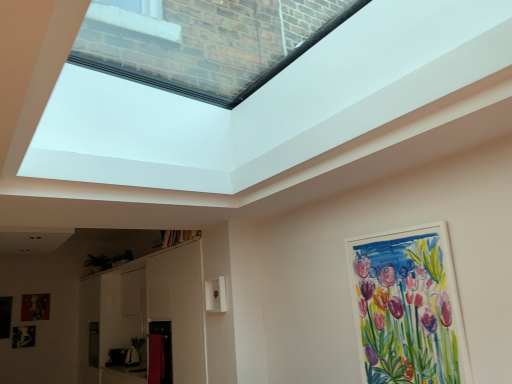
Question: Is the depth of white matte picture frame at upper right, marked as the third picture frame in a left-to-right arrangement, greater than that of transparent glass skylight at upper center?

Choices:
 (A) no
 (B) yes

Answer: (B)

Question: Is white matte picture frame at upper right, the 1th picture frame positioned from the front, placed right next to transparent glass skylight at upper center?

Choices:
 (A) yes
 (B) no

Answer: (B)

Question: Considering the relative sizes of white matte picture frame at upper right, the third picture frame viewed from the back, and transparent glass skylight at upper center in the image provided, is white matte picture frame at upper right, the third picture frame viewed from the back, bigger than transparent glass skylight at upper center?

Choices:
 (A) no
 (B) yes

Answer: (A)

Question: Is white matte picture frame at upper right, the third picture frame viewed from the back, thinner than transparent glass skylight at upper center?

Choices:
 (A) no
 (B) yes

Answer: (B)

Question: Considering the relative sizes of white matte picture frame at upper right, the third picture frame viewed from the back, and transparent glass skylight at upper center in the image provided, is white matte picture frame at upper right, the third picture frame viewed from the back, shorter than transparent glass skylight at upper center?

Choices:
 (A) yes
 (B) no

Answer: (B)

Question: Could transparent glass skylight at upper center be considered to be inside white matte picture frame at upper right, which appears as the 1th picture frame when viewed from the right?

Choices:
 (A) no
 (B) yes

Answer: (A)

Question: Can you confirm if transparent glass skylight at upper center is smaller than white matte picture frame at upper right, which appears as the first picture frame when viewed from the top?

Choices:
 (A) yes
 (B) no

Answer: (B)

Question: Is transparent glass skylight at upper center in front of white matte picture frame at upper right, the third picture frame viewed from the back?

Choices:
 (A) yes
 (B) no

Answer: (A)

Question: Considering the relative positions of transparent glass skylight at upper center and white matte picture frame at upper right, the 1th picture frame positioned from the front, in the image provided, is transparent glass skylight at upper center to the right of white matte picture frame at upper right, the 1th picture frame positioned from the front, from the viewer's perspective?

Choices:
 (A) yes
 (B) no

Answer: (B)

Question: Is white matte picture frame at upper right, which appears as the 1th picture frame when viewed from the right, at the back of transparent glass skylight at upper center?

Choices:
 (A) yes
 (B) no

Answer: (B)

Question: From the image's perspective, would you say transparent glass skylight at upper center is positioned over white matte picture frame at upper right, marked as the third picture frame in a left-to-right arrangement?

Choices:
 (A) no
 (B) yes

Answer: (B)

Question: Considering the relative positions of transparent glass skylight at upper center and white matte picture frame at upper right, which appears as the first picture frame when viewed from the top, in the image provided, is transparent glass skylight at upper center to the left of white matte picture frame at upper right, which appears as the first picture frame when viewed from the top, from the viewer's perspective?

Choices:
 (A) yes
 (B) no

Answer: (A)

Question: Does white matte picture frame at upper right, which appears as the first picture frame when viewed from the top, have a greater width compared to black matte picture frame at lower left, which is counted as the 1th picture frame, starting from the bottom?

Choices:
 (A) yes
 (B) no

Answer: (A)